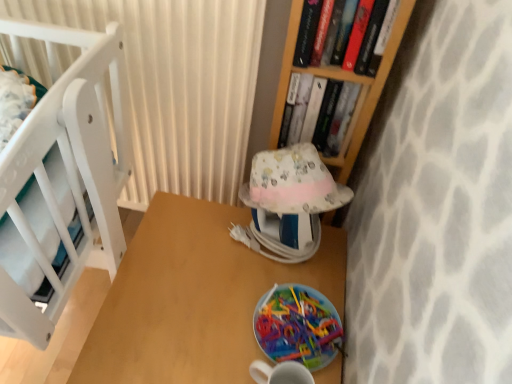
Image resolution: width=512 pixels, height=384 pixels. Find the location of `free space between patterned fabric lampshade at center and translucent plastic plate at lower center`. free space between patterned fabric lampshade at center and translucent plastic plate at lower center is located at coordinates (278, 281).